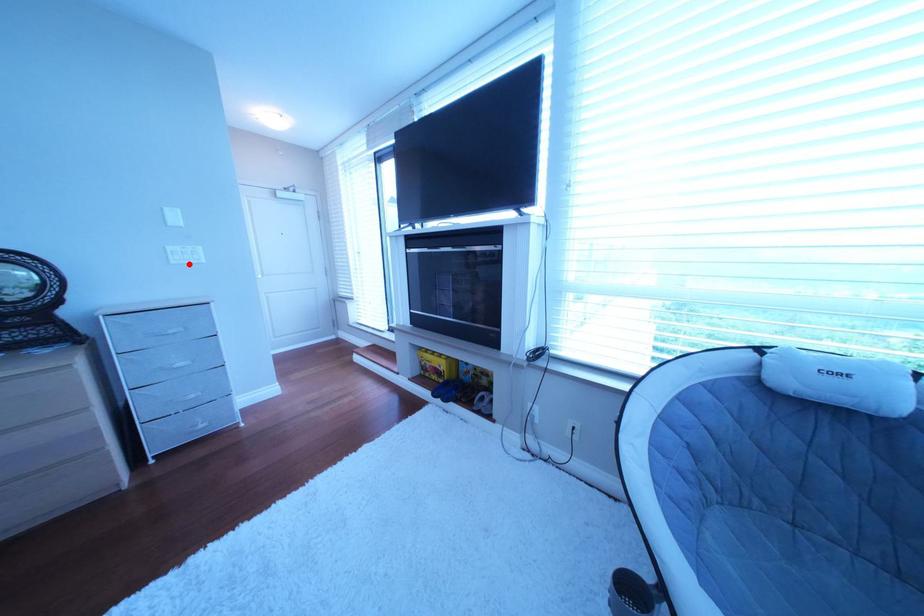
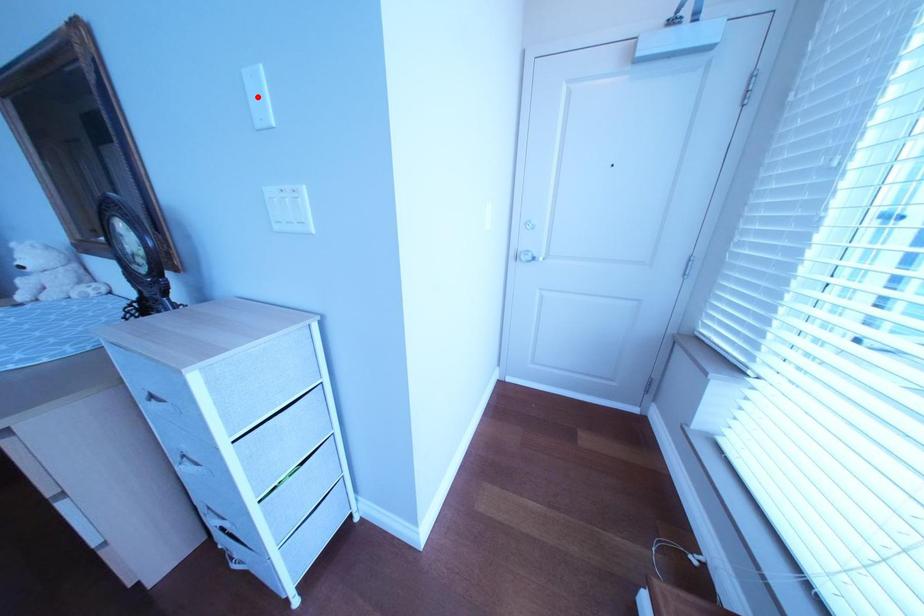
Looking at this image, I am providing you with two images of the same scene from different viewpoints. A red point is marked on the first image and another point is marked on the second image. Is the marked point in image1 the same physical position as the marked point in image2?

No